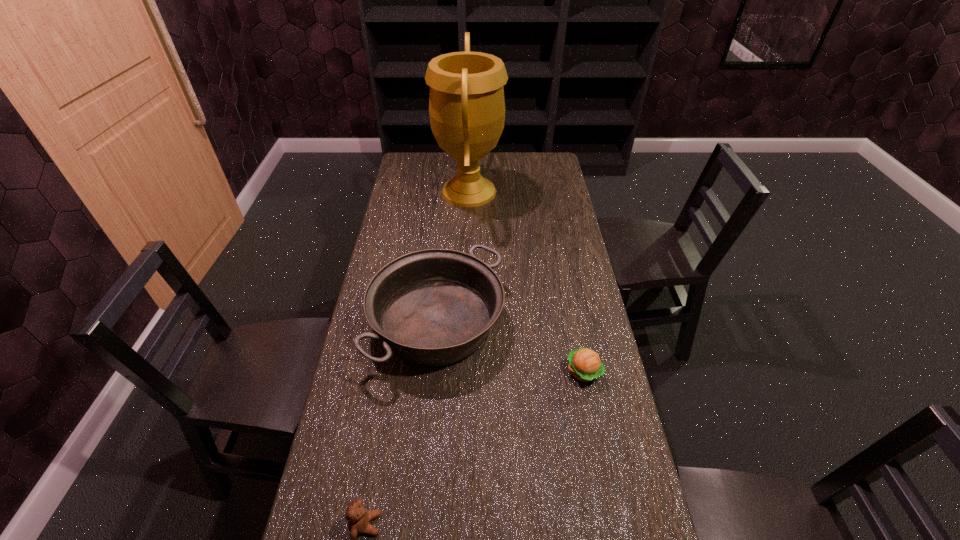
What are the coordinates of `blank region between the tallest object and the hamburger` in the screenshot? It's located at (526, 281).

Find the location of `object that is the third closest to the third tallest object`. object that is the third closest to the third tallest object is located at coordinates pos(466,104).

You are a GUI agent. You are given a task and a screenshot of the screen. Output one action in this format:
    pyautogui.click(x=<x>, y=<y>)
    Task: Click on the second closest object relative to the nearest object
    This screenshot has height=540, width=960.
    Given the screenshot: What is the action you would take?
    pyautogui.click(x=585, y=365)

Identify the location of vacant space that satisfies the following two spatial constraints: 1. on the back side of the shortest object; 2. on the engravings side of the farthest object. (548, 191).

Find the location of `free region that satisfies the following two spatial constraints: 1. on the front side of the third shortest object; 2. on the right side of the shortest object`. free region that satisfies the following two spatial constraints: 1. on the front side of the third shortest object; 2. on the right side of the shortest object is located at coordinates (433, 372).

Identify the location of free point that satisfies the following two spatial constraints: 1. on the back side of the hamburger; 2. on the engravings side of the tallest object. (548, 191).

The image size is (960, 540). Find the location of `vacant region that satisfies the following two spatial constraints: 1. on the front side of the third shortest object; 2. on the right side of the hamburger`. vacant region that satisfies the following two spatial constraints: 1. on the front side of the third shortest object; 2. on the right side of the hamburger is located at coordinates [433, 372].

Locate an element on the screen. This screenshot has width=960, height=540. vacant region that satisfies the following two spatial constraints: 1. on the engravings side of the farthest object; 2. on the front side of the second tallest object is located at coordinates (465, 322).